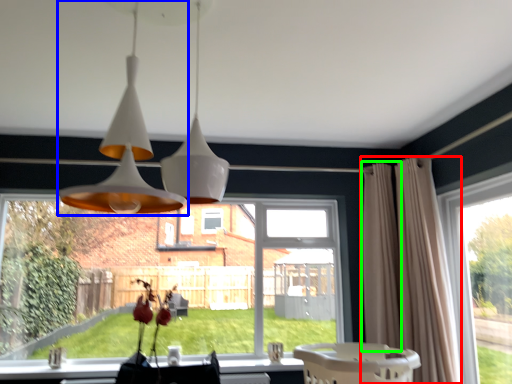
Question: Which is nearer to the curtain (highlighted by a red box)? lamp (highlighted by a blue box) or curtain (highlighted by a green box).

Choices:
 (A) lamp
 (B) curtain

Answer: (B)